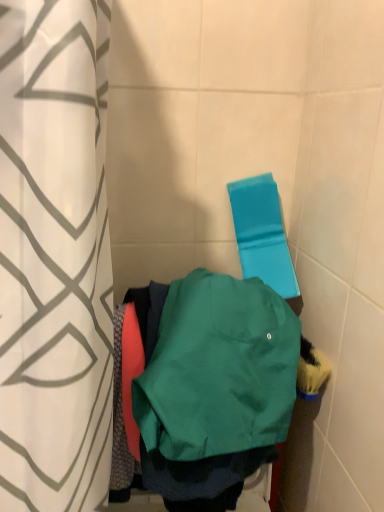
Question: Is blue fabric beach towel at upper right completely or partially inside white fabric curtain at left?

Choices:
 (A) yes
 (B) no

Answer: (B)

Question: Does white fabric curtain at left have a larger size compared to blue fabric beach towel at upper right?

Choices:
 (A) no
 (B) yes

Answer: (B)

Question: Does white fabric curtain at left come in front of blue fabric beach towel at upper right?

Choices:
 (A) yes
 (B) no

Answer: (A)

Question: Can you confirm if white fabric curtain at left is smaller than blue fabric beach towel at upper right?

Choices:
 (A) no
 (B) yes

Answer: (A)

Question: From the image's perspective, is white fabric curtain at left under blue fabric beach towel at upper right?

Choices:
 (A) no
 (B) yes

Answer: (B)

Question: Based on their positions, is white fabric curtain at left located to the left or right of blue fabric beach towel at upper right?

Choices:
 (A) left
 (B) right

Answer: (A)

Question: Which is correct: white fabric curtain at left is inside blue fabric beach towel at upper right, or outside of it?

Choices:
 (A) inside
 (B) outside

Answer: (B)

Question: In the image, is white fabric curtain at left positioned in front of or behind blue fabric beach towel at upper right?

Choices:
 (A) front
 (B) behind

Answer: (A)

Question: From a real-world perspective, is white fabric curtain at left above or below blue fabric beach towel at upper right?

Choices:
 (A) above
 (B) below

Answer: (B)

Question: Is point (238, 190) closer or farther from the camera than point (155, 396)?

Choices:
 (A) closer
 (B) farther

Answer: (B)

Question: From the image's perspective, relative to green matte sweatshirt at center, is blue fabric beach towel at upper right above or below?

Choices:
 (A) below
 (B) above

Answer: (B)

Question: Looking at their shapes, would you say blue fabric beach towel at upper right is wider or thinner than green matte sweatshirt at center?

Choices:
 (A) thin
 (B) wide

Answer: (A)

Question: From a real-world perspective, is blue fabric beach towel at upper right above or below green matte sweatshirt at center?

Choices:
 (A) above
 (B) below

Answer: (A)

Question: From a real-world perspective, is white fabric curtain at left positioned above or below green matte sweatshirt at center?

Choices:
 (A) below
 (B) above

Answer: (B)

Question: Looking at their shapes, would you say white fabric curtain at left is wider or thinner than green matte sweatshirt at center?

Choices:
 (A) wide
 (B) thin

Answer: (A)